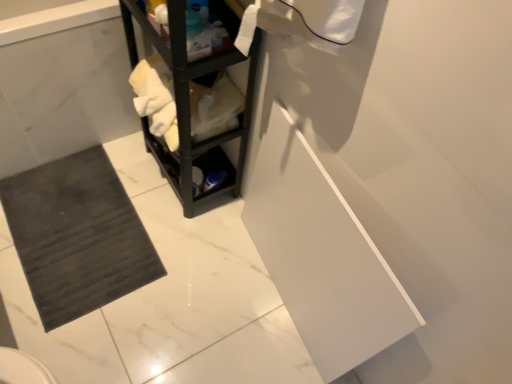
Identify the location of free space in front of black matte shelf at center. The width and height of the screenshot is (512, 384). (172, 243).